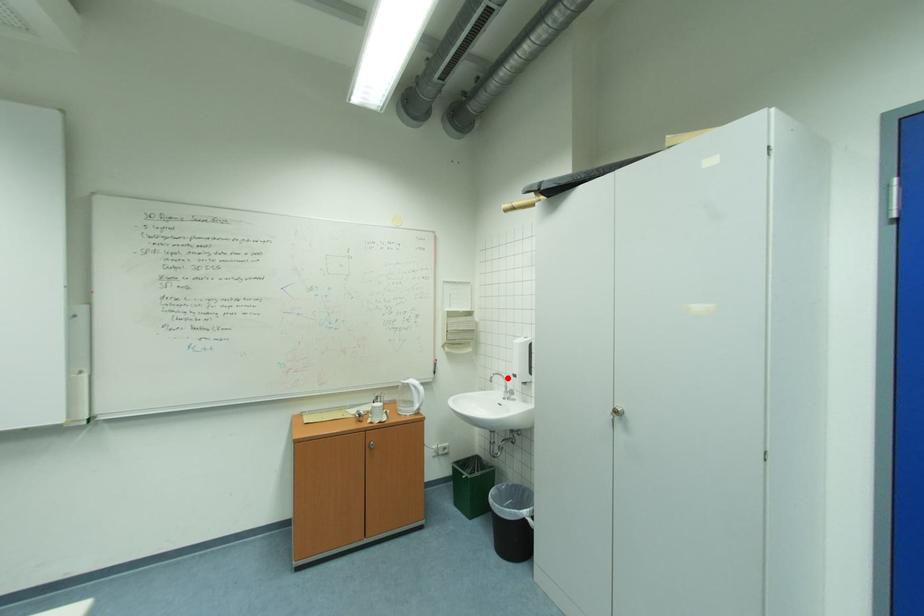
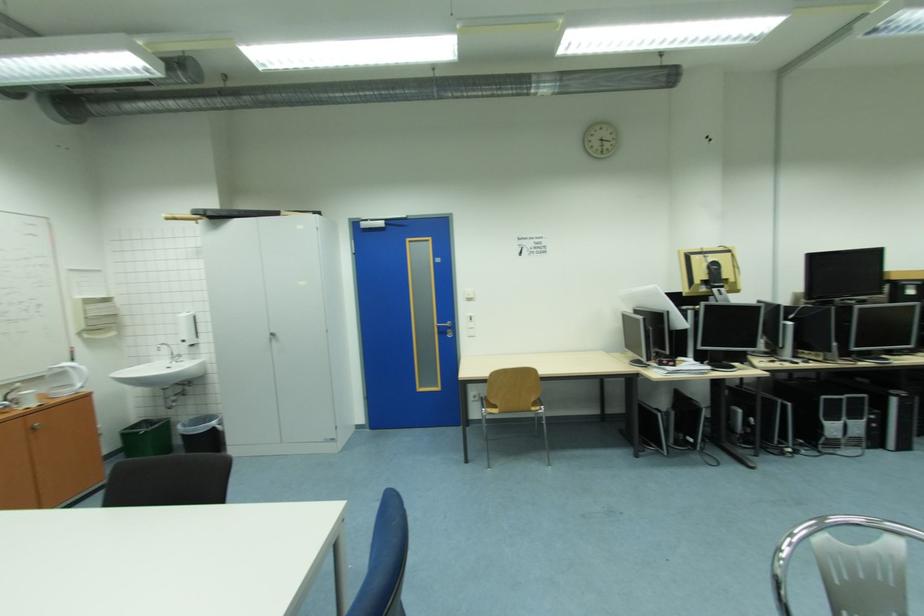
In the second image, find the point that corresponds to the highlighted location in the first image.

(171, 347)